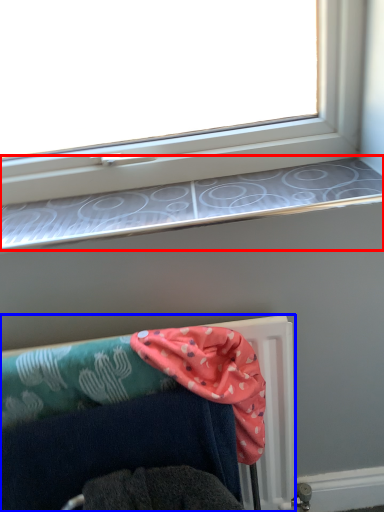
Question: Which object appears closest to the camera in this image, window sill (highlighted by a red box) or furniture (highlighted by a blue box)?

Choices:
 (A) window sill
 (B) furniture

Answer: (B)